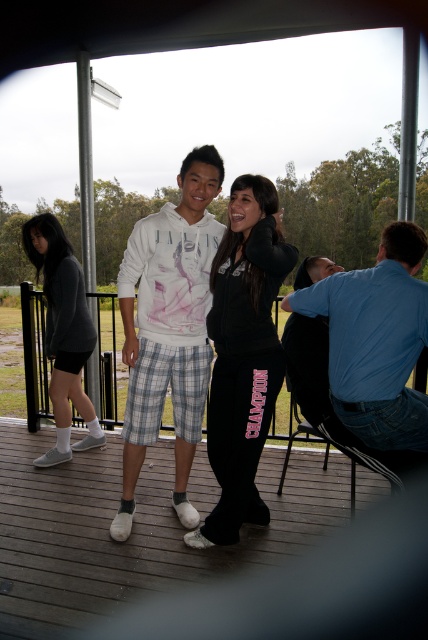
Question: Can you confirm if black fabric deck at center is wider than black fleece sweatshirt at center?

Choices:
 (A) no
 (B) yes

Answer: (B)

Question: Estimate the real-world distances between objects in this image. Which object is farther from the black fabric deck at center?

Choices:
 (A) black fleece sweatshirt at center
 (B) matte gray hoodie at left
 (C) white cotton hoodie at center
 (D) metallic blue chair at right

Answer: (B)

Question: Among these points, which one is farthest from the camera?

Choices:
 (A) (270, 532)
 (B) (137, 385)

Answer: (A)

Question: Does black fleece sweatshirt at center have a greater width compared to matte gray hoodie at left?

Choices:
 (A) yes
 (B) no

Answer: (B)

Question: Among these points, which one is nearest to the camera?

Choices:
 (A) (70, 339)
 (B) (255, 266)
 (C) (232, 556)

Answer: (B)

Question: Is black fabric deck at center bigger than matte gray hoodie at left?

Choices:
 (A) yes
 (B) no

Answer: (A)